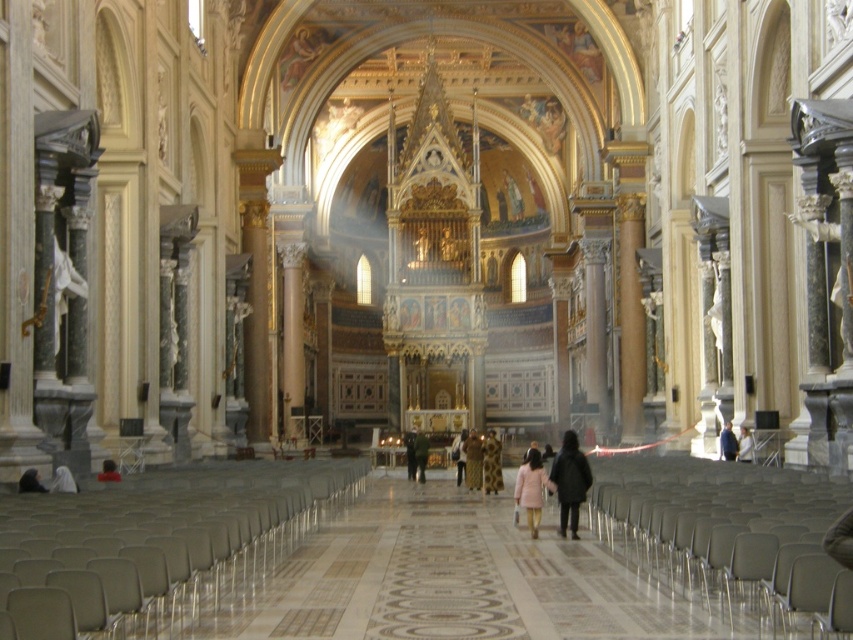
Question: Does dark matte coat at center have a greater width compared to blue denim jacket at center?

Choices:
 (A) yes
 (B) no

Answer: (A)

Question: Among these objects, which one is nearest to the camera?

Choices:
 (A) light brown leather jacket at center
 (B) blue denim jacket at center

Answer: (B)

Question: Which of the following is the closest to the observer?

Choices:
 (A) matte black person at lower left
 (B) white fabric person at lower left

Answer: (B)

Question: Which point is closer to the camera?

Choices:
 (A) (28, 490)
 (B) (563, 452)

Answer: (A)

Question: Is dark brown leather jacket at lower left below light pink fabric at center?

Choices:
 (A) yes
 (B) no

Answer: (B)

Question: Can you confirm if dark brown leather jacket at center is positioned to the right of dark brown leather coat at center?

Choices:
 (A) yes
 (B) no

Answer: (A)